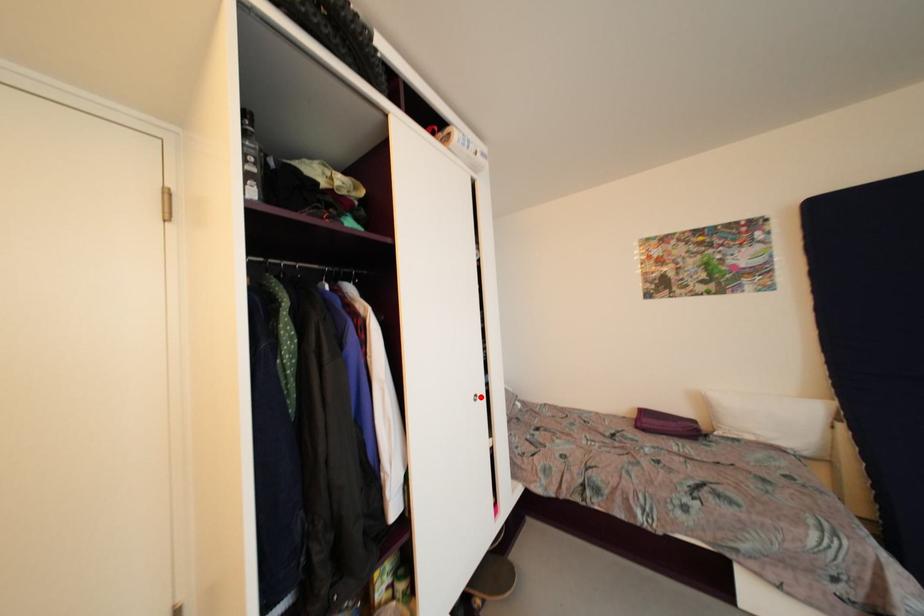
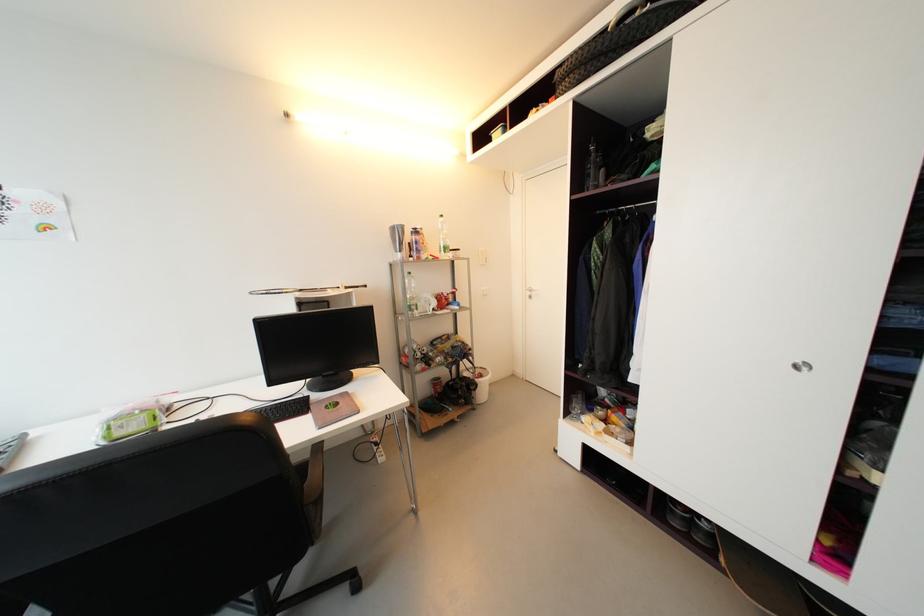
The point at the highlighted location is marked in the first image. Where is the corresponding point in the second image?

(810, 366)